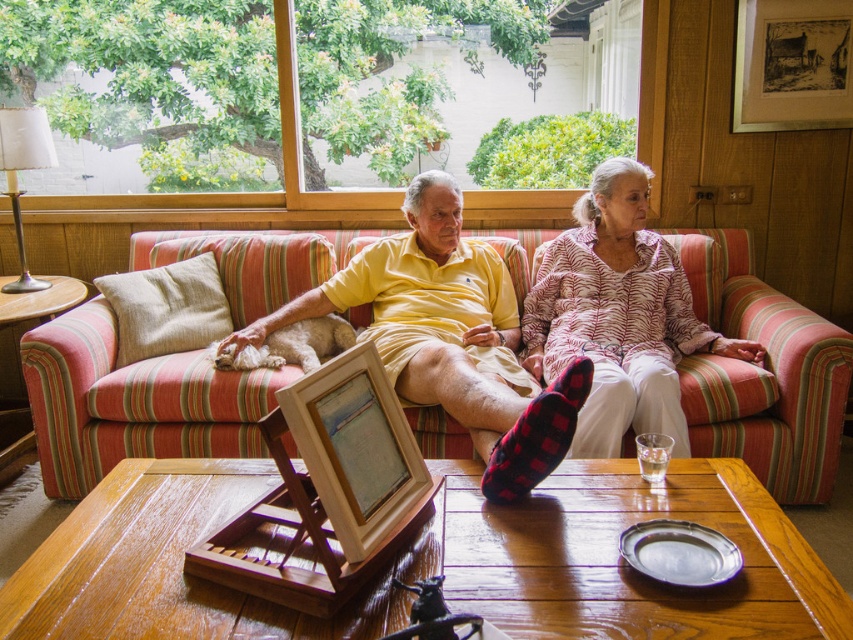
Question: Can you confirm if striped fabric couch at center is wider than red plaid sock at center?

Choices:
 (A) yes
 (B) no

Answer: (A)

Question: Is the position of striped fabric couch at center less distant than that of red plaid sock at center?

Choices:
 (A) no
 (B) yes

Answer: (A)

Question: Which point is farther to the camera?

Choices:
 (A) wooden table at center
 (B) wooden picture frame at center
 (C) red plaid sock at center

Answer: (C)

Question: Estimate the real-world distances between objects in this image. Which object is farther from the red plaid sock at center?

Choices:
 (A) striped fabric couch at center
 (B) wooden table at center

Answer: (A)

Question: Is yellow cotton shirt at center smaller than printed cotton pajama top at center?

Choices:
 (A) no
 (B) yes

Answer: (A)

Question: Which point appears closest to the camera in this image?

Choices:
 (A) (332, 445)
 (B) (625, 211)

Answer: (A)